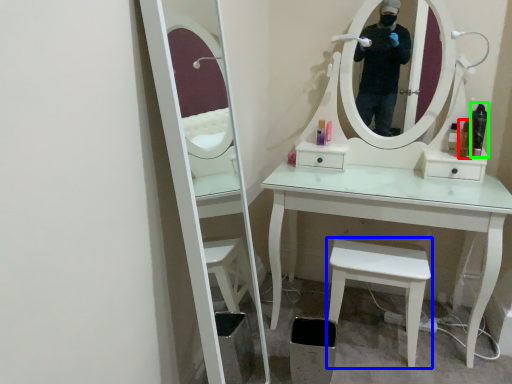
Question: Which is nearer to the toiletry (highlighted by a red box)? stool (highlighted by a blue box) or toiletry (highlighted by a green box).

Choices:
 (A) stool
 (B) toiletry

Answer: (B)